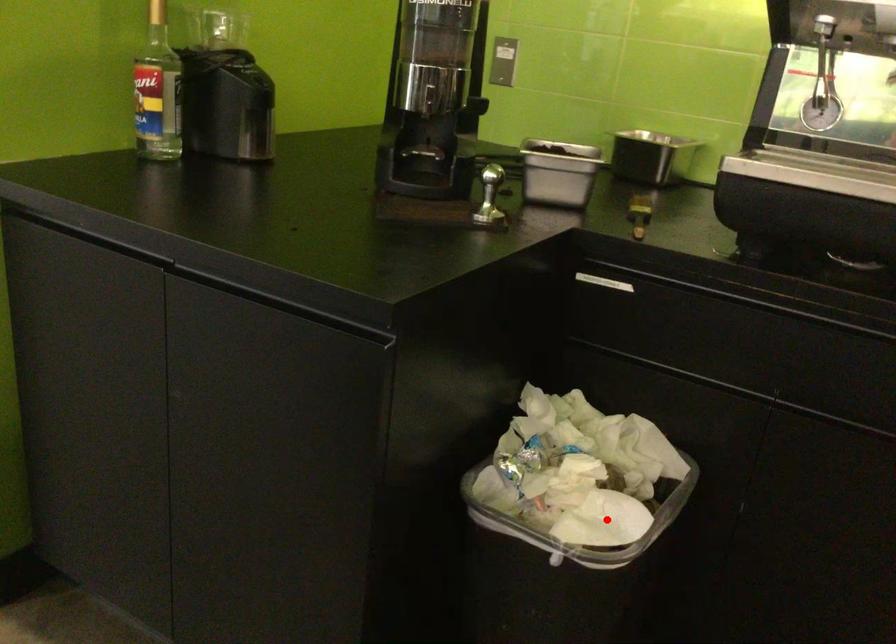
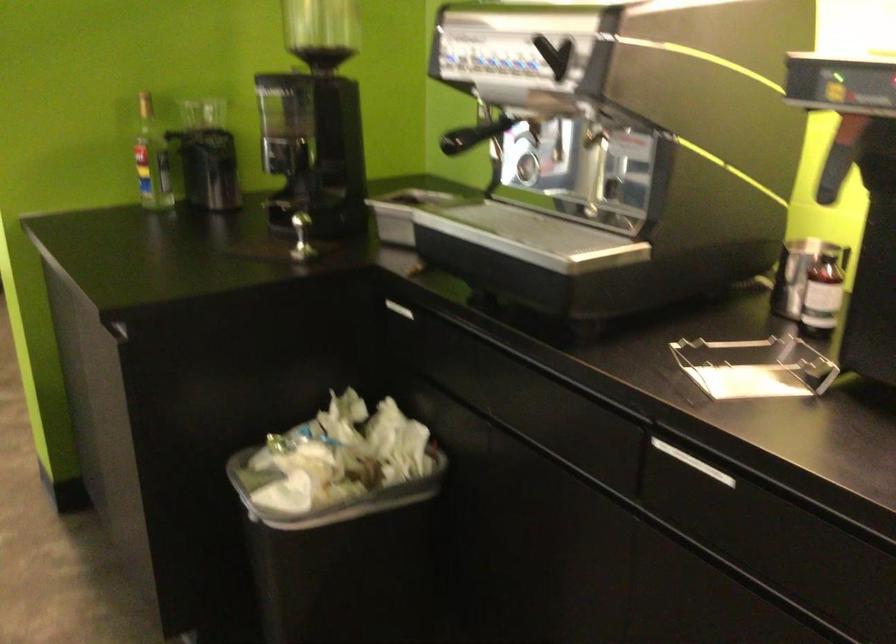
Locate, in the second image, the point that corresponds to the highlighted location in the first image.

(328, 495)